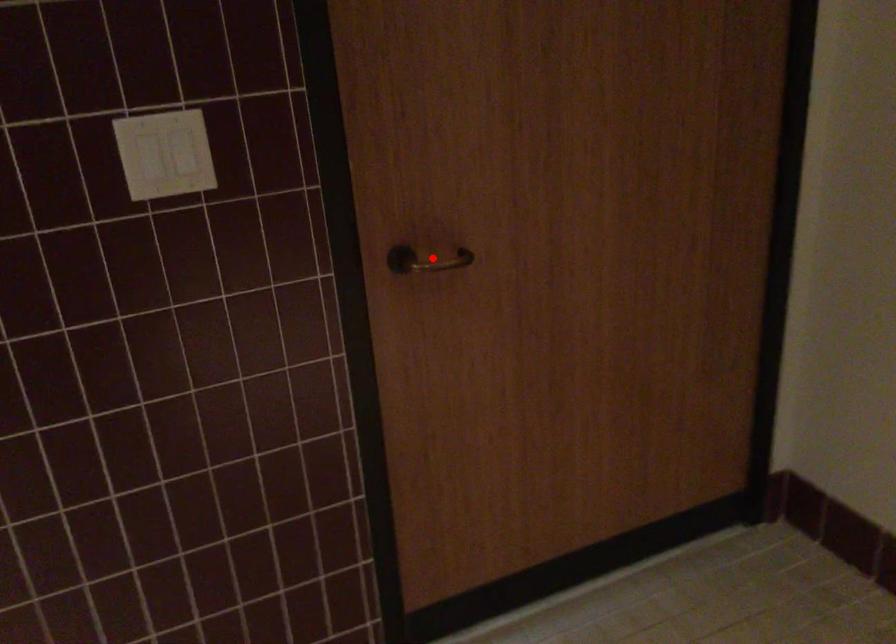
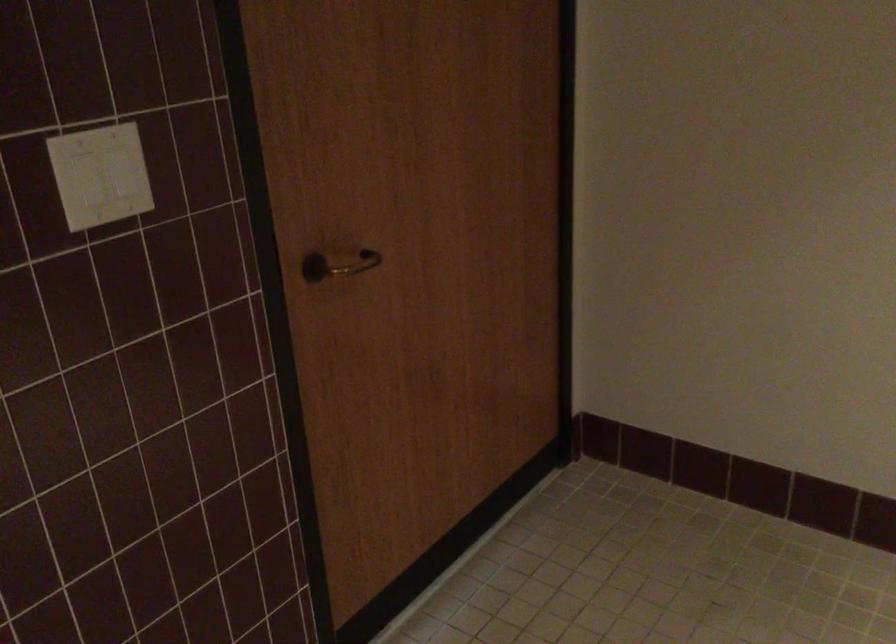
Find the pixel in the second image that matches the highlighted location in the first image.

(338, 265)